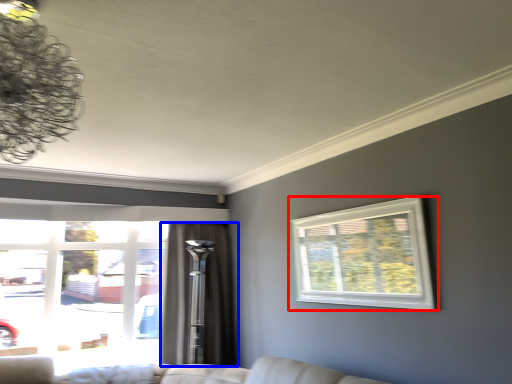
Question: Which object is closer to the camera taking this photo, window (highlighted by a red box) or curtain (highlighted by a blue box)?

Choices:
 (A) window
 (B) curtain

Answer: (A)